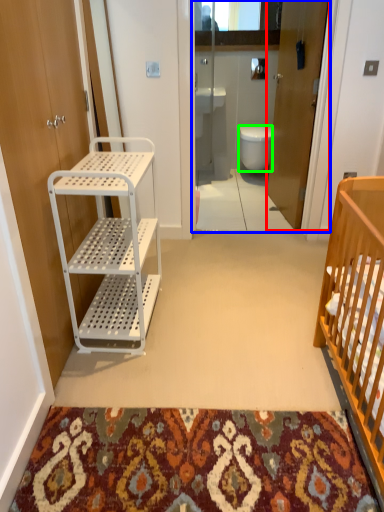
Question: Estimate the real-world distances between objects in this image. Which object is farther from door (highlighted by a red box), glass door (highlighted by a blue box) or toilet (highlighted by a green box)?

Choices:
 (A) glass door
 (B) toilet

Answer: (B)